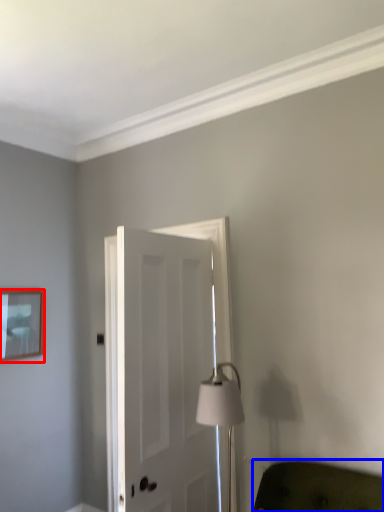
Question: Which object appears farthest to the camera in this image, picture frame (highlighted by a red box) or furniture (highlighted by a blue box)?

Choices:
 (A) picture frame
 (B) furniture

Answer: (A)